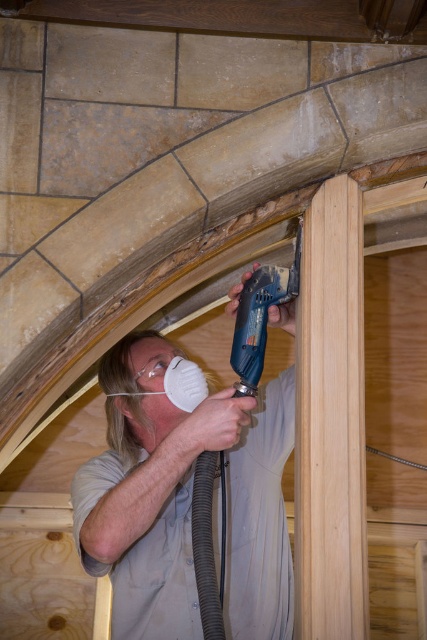
Question: Can you confirm if matte blue drill at center is positioned to the left of blue plastic drill at center?

Choices:
 (A) no
 (B) yes

Answer: (B)

Question: Which object is farther from the camera taking this photo?

Choices:
 (A) blue plastic drill at center
 (B) matte blue drill at center

Answer: (A)

Question: Can you confirm if matte blue drill at center is positioned above blue plastic drill at center?

Choices:
 (A) yes
 (B) no

Answer: (B)

Question: Which of the following is the closest to the observer?

Choices:
 (A) matte blue drill at center
 (B) blue plastic drill at center

Answer: (A)

Question: Is matte blue drill at center thinner than blue plastic drill at center?

Choices:
 (A) no
 (B) yes

Answer: (A)

Question: Which of the following is the farthest from the observer?

Choices:
 (A) coord(275,300)
 (B) coord(119,556)

Answer: (A)